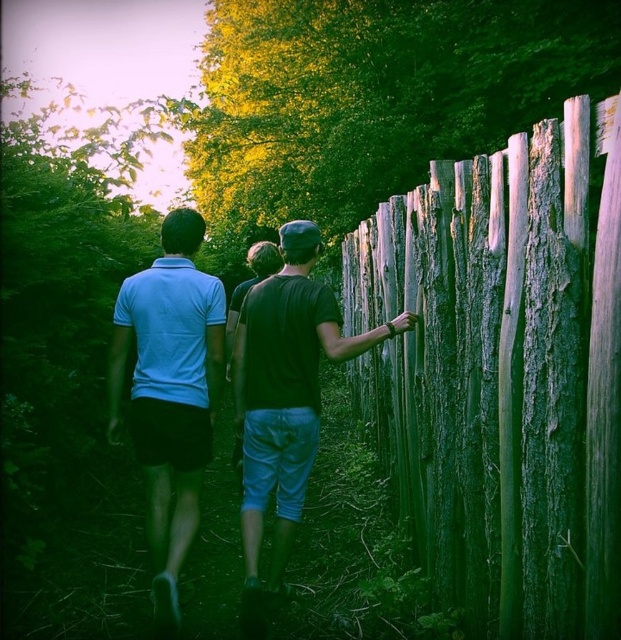
Does matte blue shirt at center have a smaller size compared to matte black shirt at right?

Yes, matte blue shirt at center is smaller than matte black shirt at right.

Is matte blue shirt at center wider than matte black shirt at right?

No.

Locate an element on the screen. Image resolution: width=621 pixels, height=640 pixels. matte blue shirt at center is located at coordinates (170, 392).

Can you confirm if weathered wood fence at right is bigger than matte black shirt at right?

Yes, weathered wood fence at right is bigger than matte black shirt at right.

Between weathered wood fence at right and matte black shirt at right, which one has less height?

Standing shorter between the two is matte black shirt at right.

I want to click on weathered wood fence at right, so click(x=504, y=372).

Who is higher up, weathered wood fence at right or matte blue shirt at center?

Positioned higher is weathered wood fence at right.

Can you confirm if weathered wood fence at right is positioned to the right of matte blue shirt at center?

Yes, weathered wood fence at right is to the right of matte blue shirt at center.

Is point (483, 284) closer to camera compared to point (199, 413)?

Yes, point (483, 284) is in front of point (199, 413).

Identify the location of weathered wood fence at right. [504, 372].